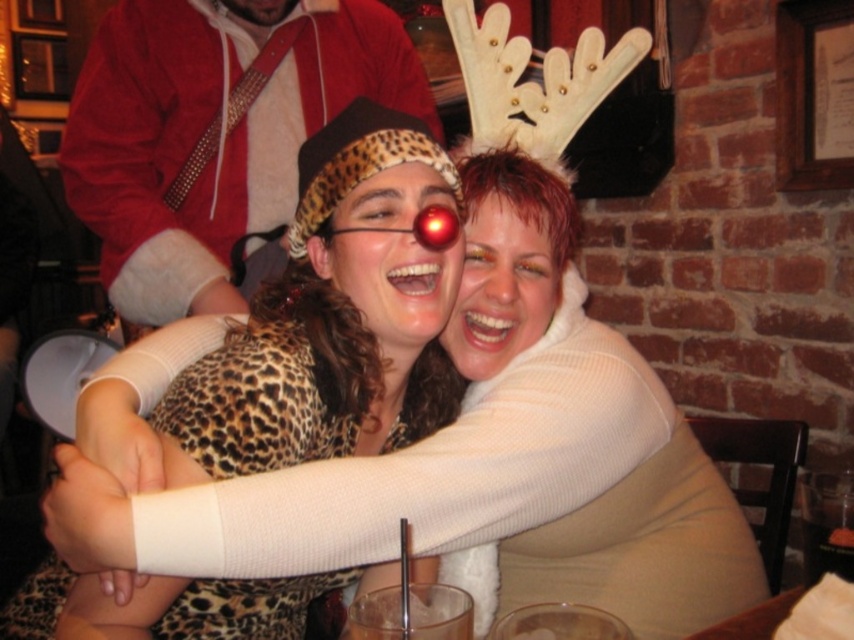
This screenshot has height=640, width=854. What do you see at coordinates (215, 134) in the screenshot?
I see `red velvet santa hat at upper left` at bounding box center [215, 134].

Locate an element on the screen. red velvet santa hat at upper left is located at coordinates (215, 134).